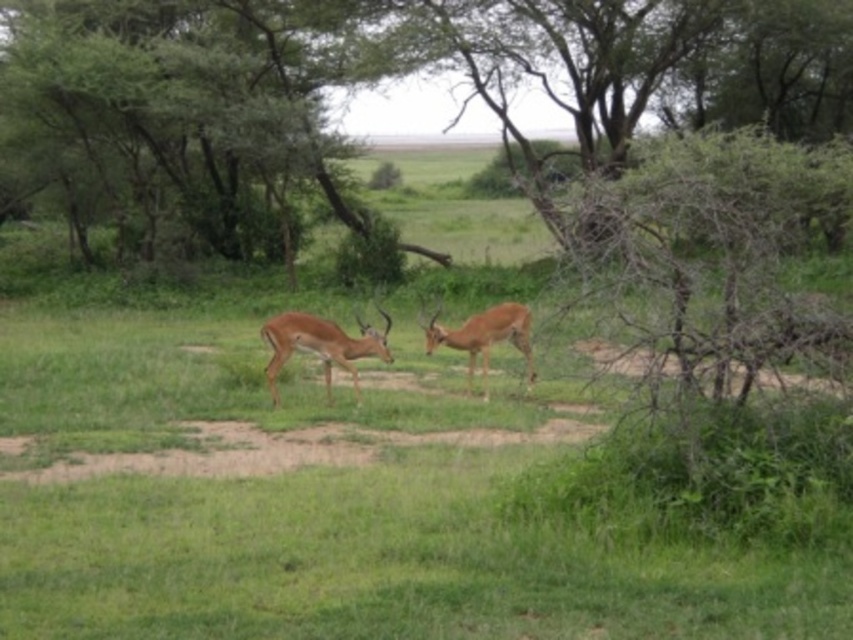
You are a wildlife photographer aiming to capture a photo of the brown matte antelope at center without the green leafy tree at center appearing in the background. You have a camera with a 50mm lens. Knowing that a 50mm lens has a field of view similar to human vision, approximately 46 degrees, and that the minimum distance to exclude the tree would require the antelope to be at least 45 feet away from the tree, can you determine if your current setup allows you to achieve this?

The green leafy tree at center is 44.98 feet from the brown matte antelope at center. Since the required minimum distance to exclude the tree is 45 feet, the current distance is just slightly less. Therefore, the photographer cannot achieve excluding the tree with the current setup as the antelope is too close to the tree.

You are an ecologist studying the spatial distribution of animals in the savanna. You observe the brown matte deer at center. Based on its coordinates, can you determine its position relative to the center of the field?

The brown matte deer at center is located at point (321, 346), which is slightly to the right and below the exact center of the field. Therefore, it is positioned near the center but slightly offset towards the lower right quadrant.